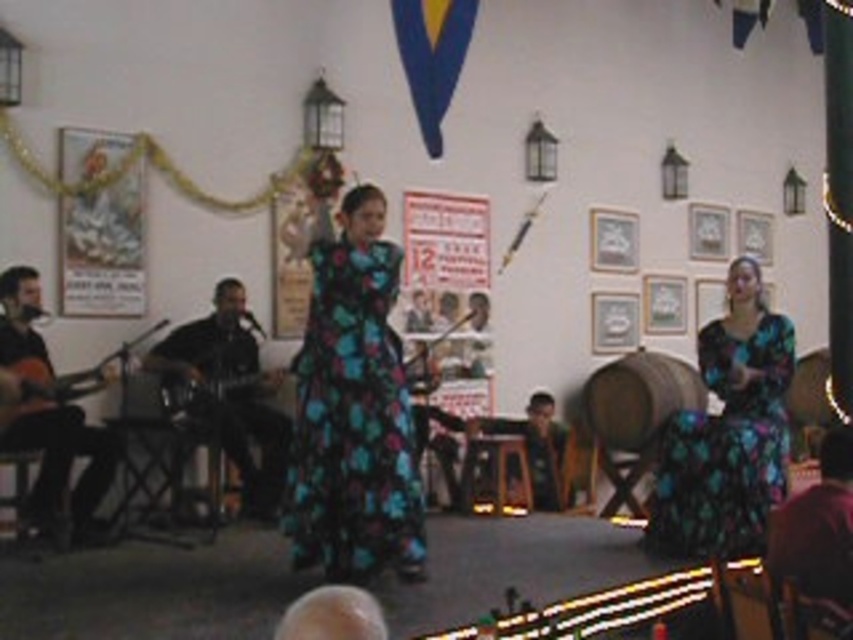
Is dark brown leather guitar at left below metallic electric guitar at left?

Yes, dark brown leather guitar at left is below metallic electric guitar at left.

Is point (254, 433) positioned before point (258, 380)?

Yes, it is.

Is point (222, 420) closer to camera compared to point (184, 369)?

That is False.

Identify the location of dark brown leather guitar at left. This screenshot has width=853, height=640. (210, 340).

Does floral-patterned fabric dress at right appear over brown leather jacket at lower right?

Indeed, floral-patterned fabric dress at right is positioned over brown leather jacket at lower right.

Does floral-patterned fabric dress at right appear on the left side of brown leather jacket at lower right?

No, floral-patterned fabric dress at right is not to the left of brown leather jacket at lower right.

You are a GUI agent. You are given a task and a screenshot of the screen. Output one action in this format:
    pyautogui.click(x=<x>, y=<y>)
    Task: Click on the floral-patterned fabric dress at right
    This screenshot has width=853, height=640.
    Given the screenshot: What is the action you would take?
    pyautogui.click(x=724, y=448)

Locate an element on the screen. floral-patterned fabric dress at right is located at coordinates (724, 448).

Can you confirm if floral-patterned fabric dress at center is positioned to the left of floral-patterned fabric dress at right?

Yes, floral-patterned fabric dress at center is to the left of floral-patterned fabric dress at right.

Is point (314, 348) in front of point (677, 424)?

Yes.

Locate an element on the screen. This screenshot has height=640, width=853. floral-patterned fabric dress at center is located at coordinates (352, 422).